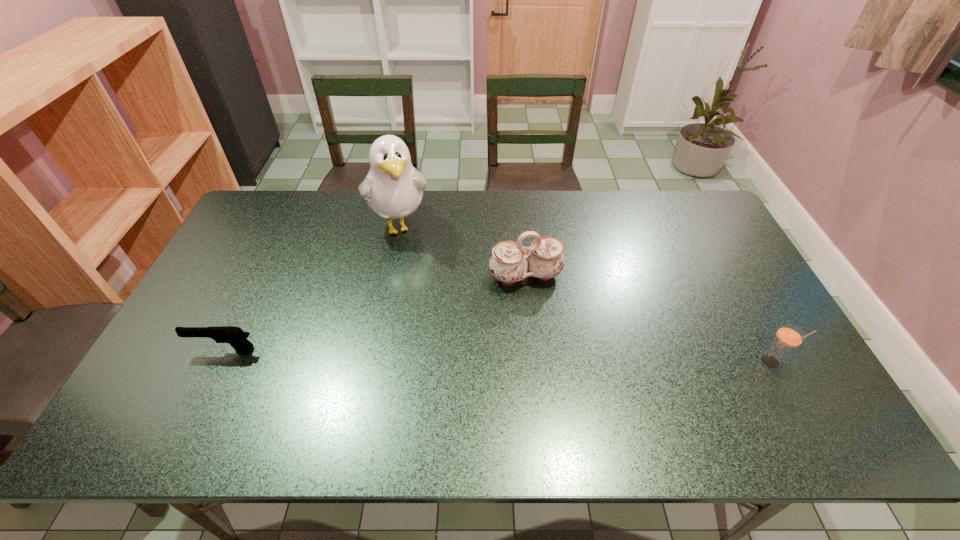
Locate an element on the screen. blank space at the right edge is located at coordinates (764, 343).

The height and width of the screenshot is (540, 960). In order to click on vacant space at the near left corner in this screenshot , I will do `click(153, 401)`.

In the image, there is a desktop. Where is `vacant space at the far right corner`? This screenshot has width=960, height=540. vacant space at the far right corner is located at coordinates (696, 191).

I want to click on free space at the near right corner of the desktop, so click(798, 382).

At what (x,y) coordinates should I click in order to perform the action: click on free space between the farthest object and the shortest object. Please return your answer as a coordinate pair (x, y). Image resolution: width=960 pixels, height=540 pixels. Looking at the image, I should click on (313, 287).

Image resolution: width=960 pixels, height=540 pixels. Find the location of `vacant point located between the straw and the leftmost object`. vacant point located between the straw and the leftmost object is located at coordinates (497, 356).

Where is `empty location between the rightmost object and the farthest object`? This screenshot has width=960, height=540. empty location between the rightmost object and the farthest object is located at coordinates (586, 294).

Locate an element on the screen. unoccupied position between the pistol and the third nearest object is located at coordinates (375, 313).

You are a GUI agent. You are given a task and a screenshot of the screen. Output one action in this format:
    pyautogui.click(x=<x>, y=<y>)
    Task: Click on the vacant space in between the pistol and the third object from right to left
    
    Given the screenshot: What is the action you would take?
    pyautogui.click(x=313, y=287)

Find the location of a particular element. The image size is (960, 540). unoccupied area between the chinaware and the gull is located at coordinates (463, 251).